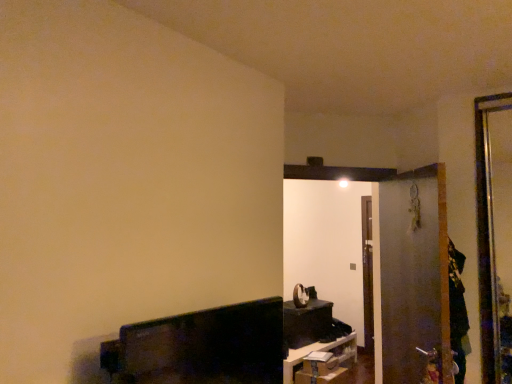
How much space does matte black shelf at lower center, which is the first furniture from bottom to top, occupy horizontally?

22.52 inches.

I want to click on matte black clock at center, the second furniture positioned from the top, so click(306, 323).

What do you see at coordinates (306, 323) in the screenshot? This screenshot has width=512, height=384. I see `matte black clock at center, the 3th furniture in the front-to-back sequence` at bounding box center [306, 323].

At what (x,y) coordinates should I click in order to perform the action: click on transparent plastic screen door at right. Please return your answer as a coordinate pair (x, y). The width and height of the screenshot is (512, 384). Looking at the image, I should click on point(413,278).

From the image's perspective, is transparent plastic screen door at right located above matte black tv at lower left, which appears as the 1th furniture when viewed from the top?

Yes, from the image's perspective, transparent plastic screen door at right is over matte black tv at lower left, which appears as the 1th furniture when viewed from the top.

Does transparent plastic screen door at right turn towards matte black tv at lower left, which is counted as the 3th furniture, starting from the bottom?

No, transparent plastic screen door at right does not turn towards matte black tv at lower left, which is counted as the 3th furniture, starting from the bottom.

In the scene shown: Can we say transparent plastic screen door at right lies outside matte black tv at lower left, the first furniture viewed from the front?

Indeed, transparent plastic screen door at right is completely outside matte black tv at lower left, the first furniture viewed from the front.

Which furniture is the 3rd one when counting from the left side of the transparent plastic screen door at right? Please provide its 2D coordinates.

[(201, 347)]

Which is more to the left, matte black tv at lower left, the third furniture positioned from the back, or matte black clock at center, which is the second furniture in bottom-to-top order?

From the viewer's perspective, matte black tv at lower left, the third furniture positioned from the back, appears more on the left side.

Between matte black tv at lower left, the first furniture viewed from the front, and matte black clock at center, the 3th furniture in the front-to-back sequence, which one has larger width?

matte black clock at center, the 3th furniture in the front-to-back sequence, is wider.

Which of these two, matte black tv at lower left, which is counted as the 3th furniture, starting from the bottom, or matte black clock at center, the 3th furniture in the front-to-back sequence, stands shorter?

matte black tv at lower left, which is counted as the 3th furniture, starting from the bottom.

In terms of width, does transparent plastic screen door at right look wider or thinner when compared to matte black shelf at lower center, arranged as the 2th furniture when viewed from the back?

Clearly, transparent plastic screen door at right has less width compared to matte black shelf at lower center, arranged as the 2th furniture when viewed from the back.

How many degrees apart are the facing directions of transparent plastic screen door at right and matte black shelf at lower center, which is the first furniture from bottom to top?

137 degrees.

Which object is further away from the camera, transparent plastic screen door at right or matte black shelf at lower center, the second furniture in the front-to-back sequence?

Positioned behind is matte black shelf at lower center, the second furniture in the front-to-back sequence.

How distant is transparent plastic screen door at right from matte black shelf at lower center, the second furniture in the front-to-back sequence?

The distance of transparent plastic screen door at right from matte black shelf at lower center, the second furniture in the front-to-back sequence, is 1.80 meters.

Considering the sizes of transparent plastic screen door at right and matte black clock at center, the 3th furniture in the front-to-back sequence, in the image, is transparent plastic screen door at right taller or shorter than matte black clock at center, the 3th furniture in the front-to-back sequence,?

Considering their sizes, transparent plastic screen door at right has more height than matte black clock at center, the 3th furniture in the front-to-back sequence.

From a real-world perspective, which is physically above, transparent plastic screen door at right or matte black clock at center, the second furniture positioned from the top?

transparent plastic screen door at right.

Would you consider transparent plastic screen door at right to be distant from matte black clock at center, the second furniture positioned from the top?

Indeed, transparent plastic screen door at right is not near matte black clock at center, the second furniture positioned from the top.

From the image's perspective, is transparent plastic screen door at right above matte black clock at center, the second furniture positioned from the top?

Correct, transparent plastic screen door at right appears higher than matte black clock at center, the second furniture positioned from the top, in the image.

In terms of height, does matte black tv at lower left, the third furniture positioned from the back, look taller or shorter compared to matte black shelf at lower center, which is the first furniture from bottom to top?

Clearly, matte black tv at lower left, the third furniture positioned from the back, is taller compared to matte black shelf at lower center, which is the first furniture from bottom to top.

From a real-world perspective, which object rests below the other?

matte black shelf at lower center, the second furniture in the front-to-back sequence, from a real-world perspective.

Which is in front, point (192, 324) or point (310, 344)?

Positioned in front is point (192, 324).

Is matte black tv at lower left, which is counted as the 3th furniture, starting from the bottom, beside matte black shelf at lower center, arranged as the 2th furniture when viewed from the back?

No, matte black tv at lower left, which is counted as the 3th furniture, starting from the bottom, is not making contact with matte black shelf at lower center, arranged as the 2th furniture when viewed from the back.

Is point (294, 358) more distant than point (415, 313)?

Yes.

Looking at the image, does matte black shelf at lower center, arranged as the 2th furniture when viewed from the back, seem bigger or smaller compared to transparent plastic screen door at right?

Considering their sizes, matte black shelf at lower center, arranged as the 2th furniture when viewed from the back, takes up more space than transparent plastic screen door at right.

From a real-world perspective, is matte black shelf at lower center, which appears as the 3th furniture when viewed from the top, located higher than transparent plastic screen door at right?

No, from a real-world perspective, matte black shelf at lower center, which appears as the 3th furniture when viewed from the top, is not above transparent plastic screen door at right.

Can you tell me how much matte black shelf at lower center, which appears as the 3th furniture when viewed from the top, and transparent plastic screen door at right differ in facing direction?

There is a 137-degree angle between the facing directions of matte black shelf at lower center, which appears as the 3th furniture when viewed from the top, and transparent plastic screen door at right.

Which of these two, matte black shelf at lower center, arranged as the 2th furniture when viewed from the back, or matte black clock at center, which is the second furniture in bottom-to-top order, stands taller?

Standing taller between the two is matte black clock at center, which is the second furniture in bottom-to-top order.

How many degrees apart are the facing directions of matte black shelf at lower center, the second furniture in the front-to-back sequence, and matte black clock at center, the 3th furniture in the front-to-back sequence?

1.22 degrees separate the facing orientations of matte black shelf at lower center, the second furniture in the front-to-back sequence, and matte black clock at center, the 3th furniture in the front-to-back sequence.

Is there a large distance between matte black shelf at lower center, the second furniture in the front-to-back sequence, and matte black clock at center, the second furniture positioned from the top?

That's not correct — matte black shelf at lower center, the second furniture in the front-to-back sequence, is a little close to matte black clock at center, the second furniture positioned from the top.

Which furniture is the 1st one when counting from the front of the matte black clock at center, the second furniture positioned from the top? Please provide its 2D coordinates.

[(313, 351)]

I want to click on the 1st furniture positioned below the transparent plastic screen door at right (from a real-world perspective), so pyautogui.click(x=201, y=347).

You are a GUI agent. You are given a task and a screenshot of the screen. Output one action in this format:
    pyautogui.click(x=<x>, y=<y>)
    Task: Click on the furniture on the left of matte black clock at center, the 3th furniture in the front-to-back sequence
    
    Given the screenshot: What is the action you would take?
    pyautogui.click(x=201, y=347)

Based on their spatial positions, is matte black tv at lower left, the third furniture positioned from the back, or matte black shelf at lower center, which is the first furniture from bottom to top, further from matte black clock at center, which is the second furniture in bottom-to-top order?

matte black tv at lower left, the third furniture positioned from the back, lies further to matte black clock at center, which is the second furniture in bottom-to-top order, than the other object.

When comparing their distances from transparent plastic screen door at right, does matte black clock at center, the second furniture positioned from the top, or matte black tv at lower left, the third furniture positioned from the back, seem further?

matte black clock at center, the second furniture positioned from the top, is positioned further to the anchor transparent plastic screen door at right.

When comparing their distances from matte black shelf at lower center, the second furniture in the front-to-back sequence, does transparent plastic screen door at right or matte black tv at lower left, the first furniture viewed from the front, seem closer?

Among the two, transparent plastic screen door at right is located nearer to matte black shelf at lower center, the second furniture in the front-to-back sequence.

Based on their spatial positions, is matte black clock at center, which is the second furniture in bottom-to-top order, or transparent plastic screen door at right closer to matte black tv at lower left, which appears as the 1th furniture when viewed from the top?

The object closer to matte black tv at lower left, which appears as the 1th furniture when viewed from the top, is transparent plastic screen door at right.

From the image, which object appears to be farther from matte black shelf at lower center, arranged as the 2th furniture when viewed from the back, transparent plastic screen door at right or matte black clock at center, the 3th furniture in the front-to-back sequence?

Among the two, transparent plastic screen door at right is located further to matte black shelf at lower center, arranged as the 2th furniture when viewed from the back.

When comparing their distances from transparent plastic screen door at right, does matte black shelf at lower center, which appears as the 3th furniture when viewed from the top, or matte black clock at center, which is the second furniture in bottom-to-top order, seem further?

Based on the image, matte black clock at center, which is the second furniture in bottom-to-top order, appears to be further to transparent plastic screen door at right.

Which object lies nearer to the anchor point matte black shelf at lower center, the second furniture in the front-to-back sequence, matte black clock at center, which appears as the 1th furniture when viewed from the back, or matte black tv at lower left, the first furniture viewed from the front?

Based on the image, matte black clock at center, which appears as the 1th furniture when viewed from the back, appears to be nearer to matte black shelf at lower center, the second furniture in the front-to-back sequence.

Estimate the real-world distances between objects in this image. Which object is closer to matte black tv at lower left, which is counted as the 3th furniture, starting from the bottom, matte black clock at center, the second furniture positioned from the top, or matte black shelf at lower center, the second furniture in the front-to-back sequence?

matte black shelf at lower center, the second furniture in the front-to-back sequence, is positioned closer to the anchor matte black tv at lower left, which is counted as the 3th furniture, starting from the bottom.

Where is `screen door positioned between matte black tv at lower left, which is counted as the 3th furniture, starting from the bottom, and matte black shelf at lower center, the second furniture in the front-to-back sequence, from near to far`? screen door positioned between matte black tv at lower left, which is counted as the 3th furniture, starting from the bottom, and matte black shelf at lower center, the second furniture in the front-to-back sequence, from near to far is located at coordinates (413, 278).

The width and height of the screenshot is (512, 384). Find the location of `screen door positioned between matte black tv at lower left, the first furniture viewed from the front, and matte black clock at center, the 3th furniture in the front-to-back sequence, from near to far`. screen door positioned between matte black tv at lower left, the first furniture viewed from the front, and matte black clock at center, the 3th furniture in the front-to-back sequence, from near to far is located at coordinates (413, 278).

The image size is (512, 384). I want to click on furniture between matte black tv at lower left, the third furniture positioned from the back, and matte black clock at center, the second furniture positioned from the top, in the front-back direction, so click(x=313, y=351).

You are a GUI agent. You are given a task and a screenshot of the screen. Output one action in this format:
    pyautogui.click(x=<x>, y=<y>)
    Task: Click on the furniture between transparent plastic screen door at right and matte black clock at center, the 3th furniture in the front-to-back sequence, from front to back
    The height and width of the screenshot is (384, 512).
    Given the screenshot: What is the action you would take?
    pyautogui.click(x=313, y=351)